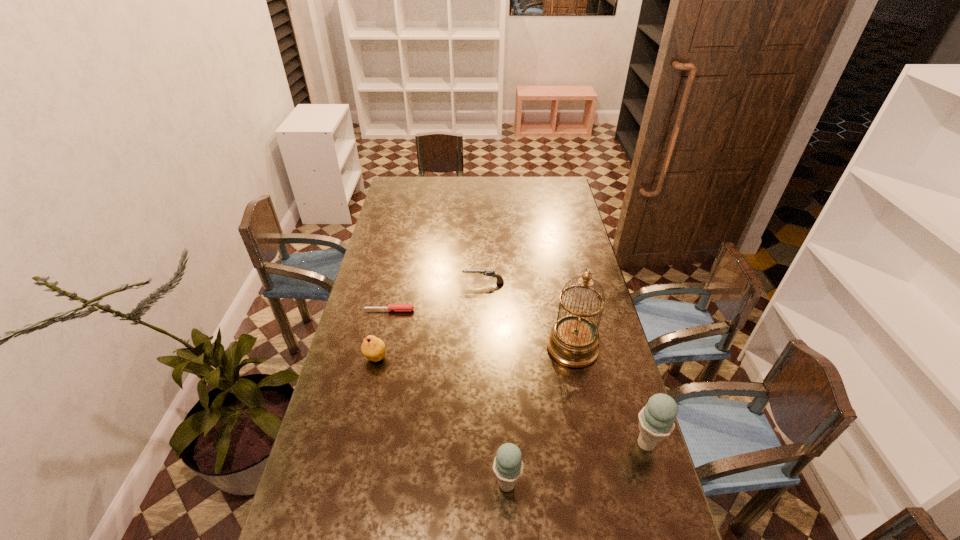
The height and width of the screenshot is (540, 960). What are the coordinates of `blank space located on the right of the shortest object` in the screenshot? It's located at (492, 310).

Where is `pear at the left edge`? The height and width of the screenshot is (540, 960). pear at the left edge is located at coordinates click(373, 348).

At what (x,y) coordinates should I click in order to perform the action: click on screwdriver positioned at the left edge. Please return your answer as a coordinate pair (x, y). This screenshot has width=960, height=540. Looking at the image, I should click on (396, 307).

I want to click on ice cream that is at the right edge, so click(x=656, y=420).

This screenshot has width=960, height=540. In order to click on birdcage that is at the right edge in this screenshot , I will do `click(574, 340)`.

Find the location of a particular element. Image resolution: width=960 pixels, height=540 pixels. vacant space at the far edge of the desktop is located at coordinates 424,195.

The width and height of the screenshot is (960, 540). What are the coordinates of `vacant space at the near edge of the desktop` in the screenshot? It's located at (511, 520).

Where is `free space at the left edge`? This screenshot has height=540, width=960. free space at the left edge is located at coordinates (338, 498).

Identify the location of vacant space at the right edge. (563, 282).

Image resolution: width=960 pixels, height=540 pixels. In order to click on free region at the far left corner in this screenshot , I will do `click(396, 193)`.